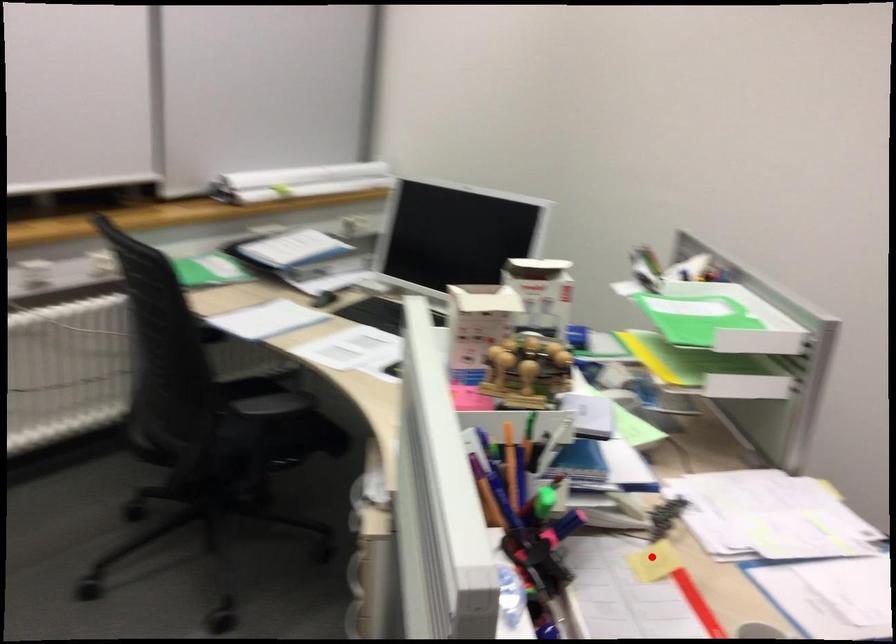
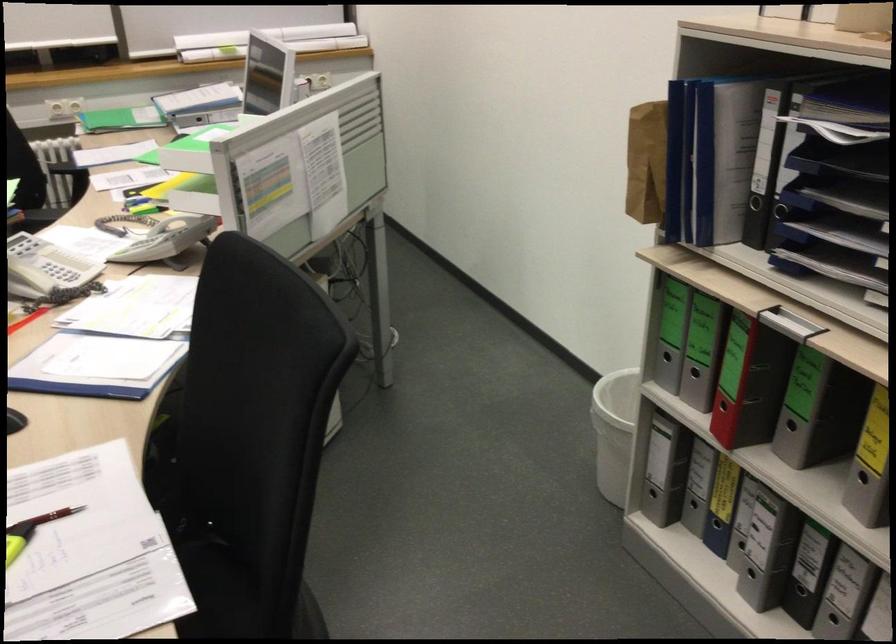
In the second image, find the point that corresponds to the highlighted location in the first image.

(26, 319)